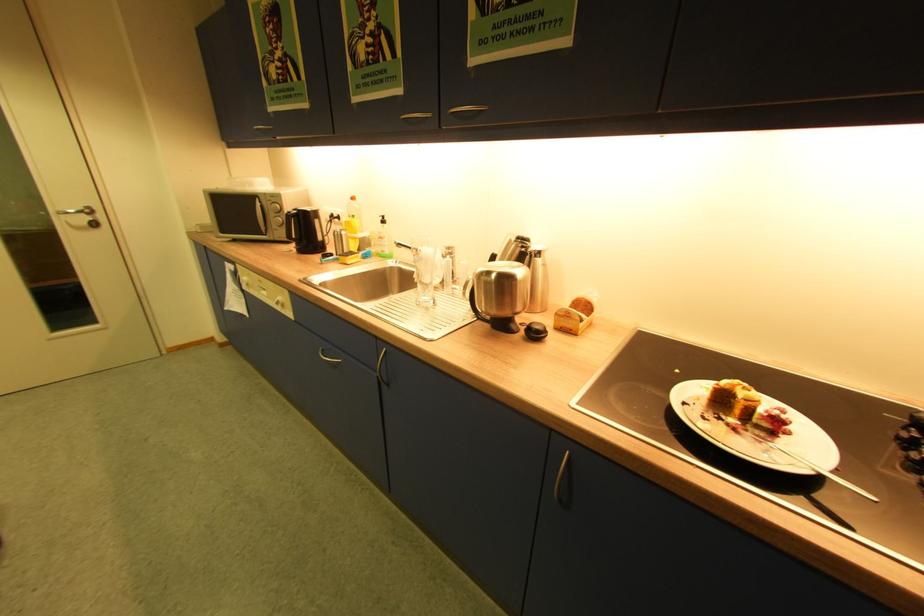
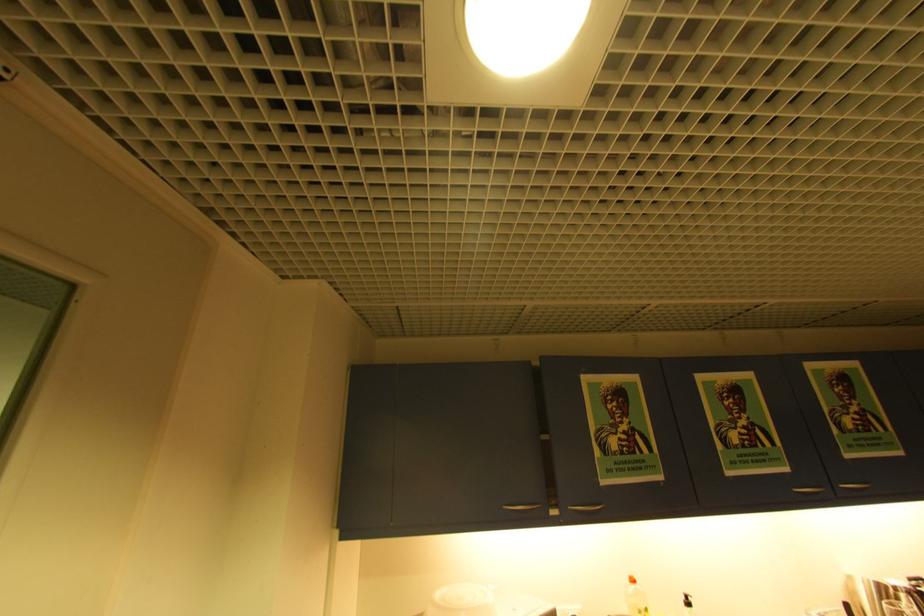
Where in the second image is the point corresponding to the point at 388,223 from the first image?

(695, 605)